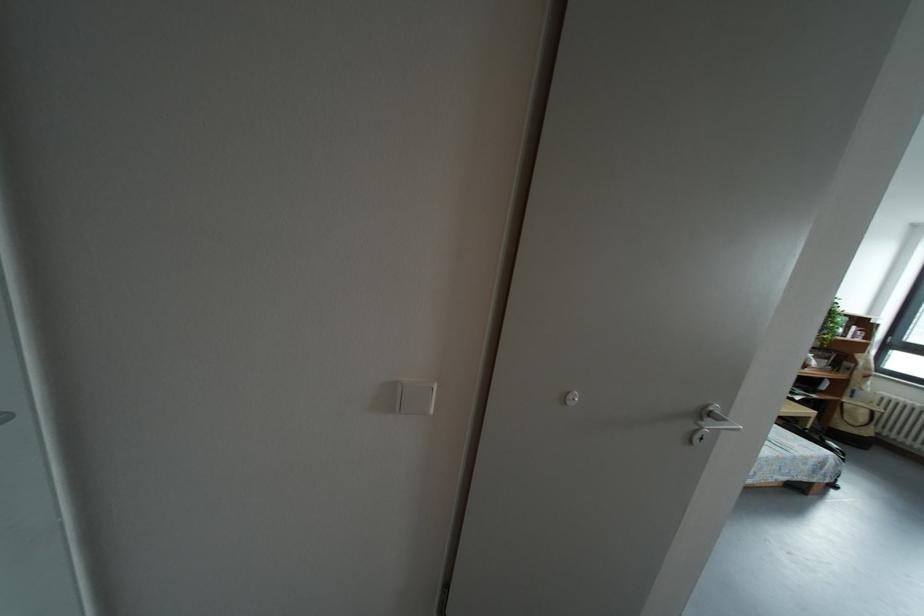
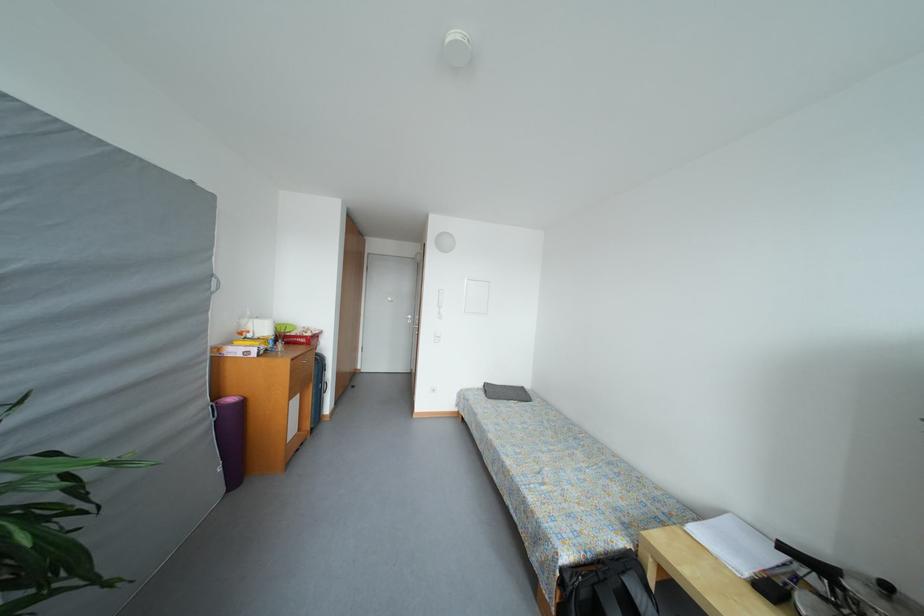
Question: I am providing you with two images of the same scene from different viewpoints. Please identify which objects are invisible in image2.

Choices:
 (A) drawer handle
 (B) silver door handle
 (C) clear storage box
 (D) grey cushion

Answer: (B)